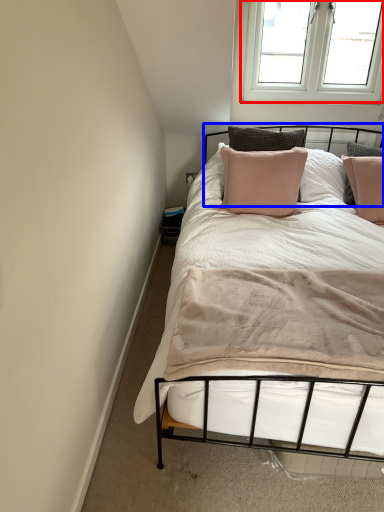
Question: Which of the following is the farthest to the observer, window (highlighted by a red box) or headboard (highlighted by a blue box)?

Choices:
 (A) window
 (B) headboard

Answer: (A)